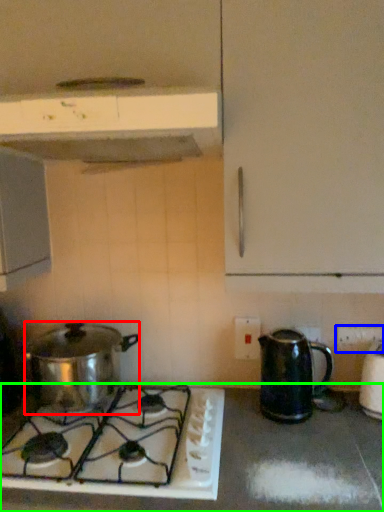
Question: Which is nearer to the kitchen appliance (highlighted by a red box)? electric outlet (highlighted by a blue box) or countertop (highlighted by a green box).

Choices:
 (A) electric outlet
 (B) countertop

Answer: (B)